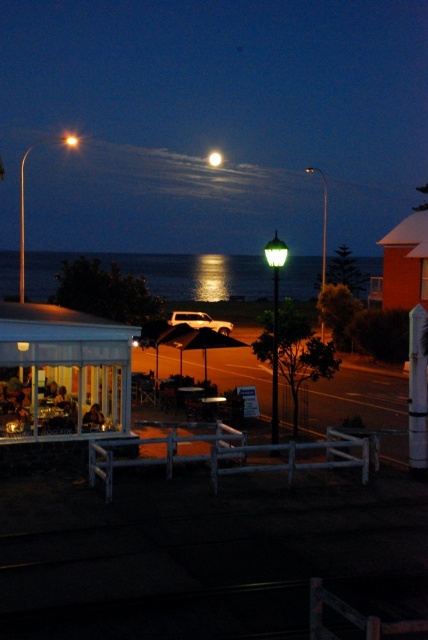
Question: Does glistening reflective water at center appear on the right side of white painted wood post at center right?

Choices:
 (A) yes
 (B) no

Answer: (B)

Question: Which point is closer to the camera?

Choices:
 (A) white painted wood post at center right
 (B) bright white orb at upper center

Answer: (A)

Question: Which object is farther from the camera taking this photo?

Choices:
 (A) transparent glass gazebo at lower left
 (B) white painted wood post at center right
 (C) bright white orb at upper center

Answer: (C)

Question: Which of the following is the farthest from the observer?

Choices:
 (A) (86, 346)
 (B) (210, 157)

Answer: (B)

Question: Is glistening reflective water at center positioned at the back of black matte umbrella at center?

Choices:
 (A) no
 (B) yes

Answer: (A)

Question: Is glistening reflective water at center positioned at the back of bright white orb at upper center?

Choices:
 (A) yes
 (B) no

Answer: (B)